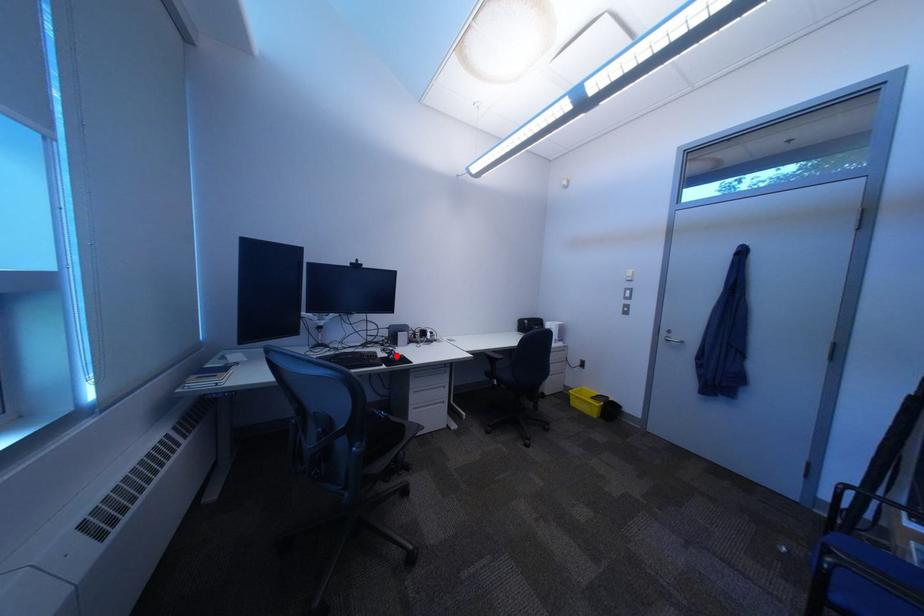
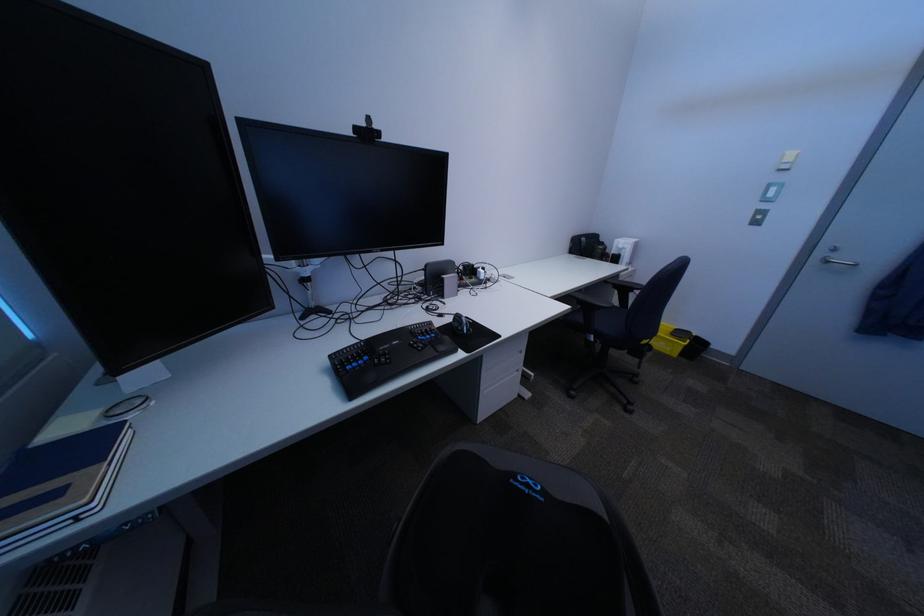
Where in the second image is the point corresponding to the highlighted location from the first image?

(454, 325)